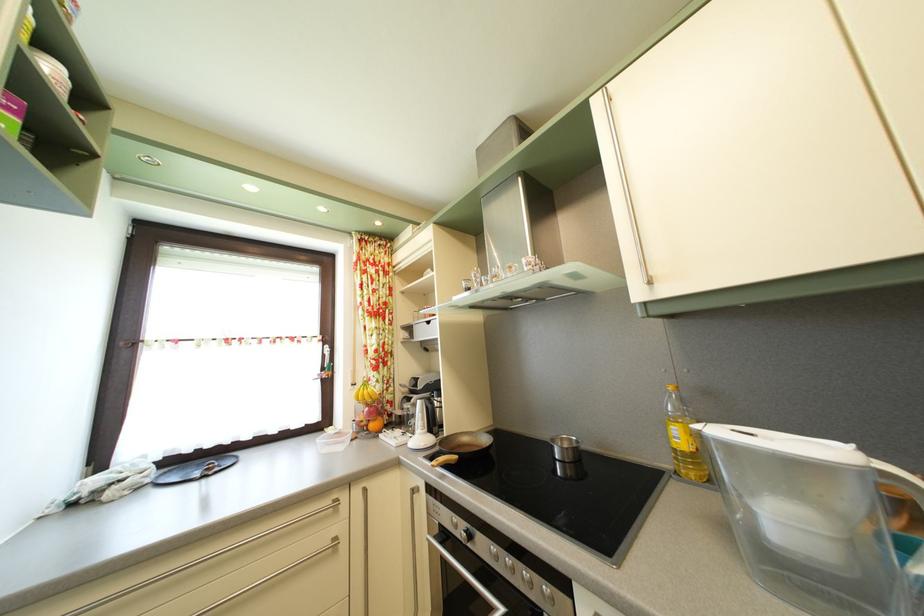
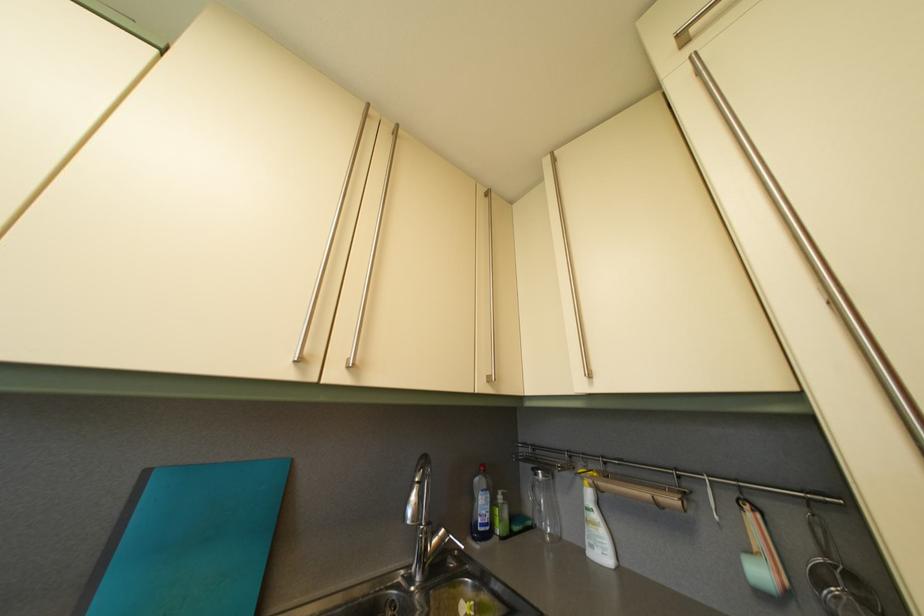
How did the camera likely rotate?

The rotation direction of the camera is right-up.